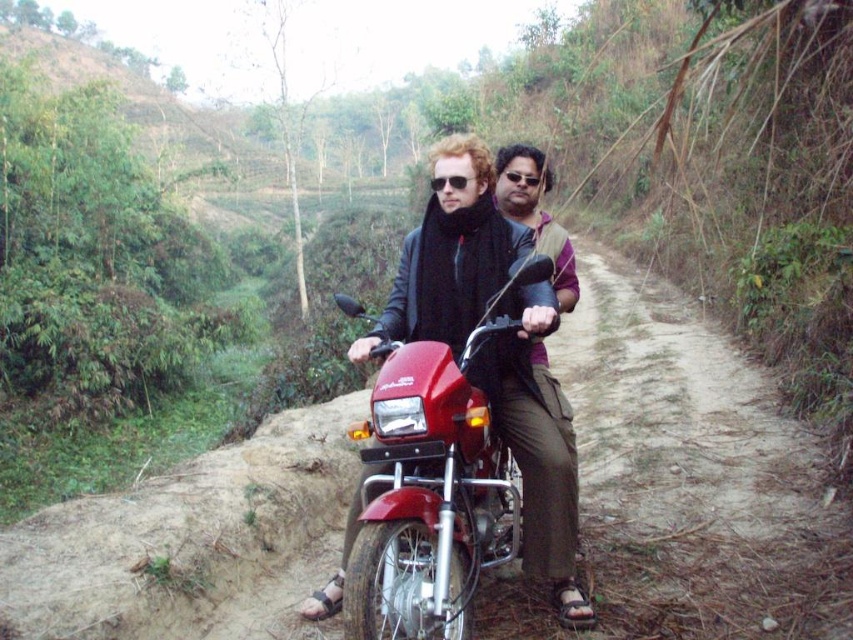
Measure the distance from dirt track at center to matte black vest at center.

dirt track at center and matte black vest at center are 20.19 inches apart from each other.

Can you confirm if dirt track at center is smaller than matte black vest at center?

Yes, dirt track at center is smaller than matte black vest at center.

Is point (254, 557) less distant than point (531, 154)?

No.

Locate an element on the screen. The width and height of the screenshot is (853, 640). dirt track at center is located at coordinates (685, 481).

Is dirt track at center further to the viewer compared to matte black motorcycle at center?

Yes, it is behind matte black motorcycle at center.

Can you confirm if dirt track at center is wider than matte black motorcycle at center?

In fact, dirt track at center might be narrower than matte black motorcycle at center.

Is point (241, 536) farther from viewer compared to point (403, 268)?

That is True.

I want to click on dirt track at center, so click(685, 481).

Does matte black motorcycle at center lie behind matte black vest at center?

No, matte black motorcycle at center is closer to the viewer.

Is matte black motorcycle at center below matte black vest at center?

No, matte black motorcycle at center is not below matte black vest at center.

Is point (399, 269) positioned after point (561, 451)?

Yes, point (399, 269) is farther from viewer.

Identify the location of matte black motorcycle at center. (457, 244).